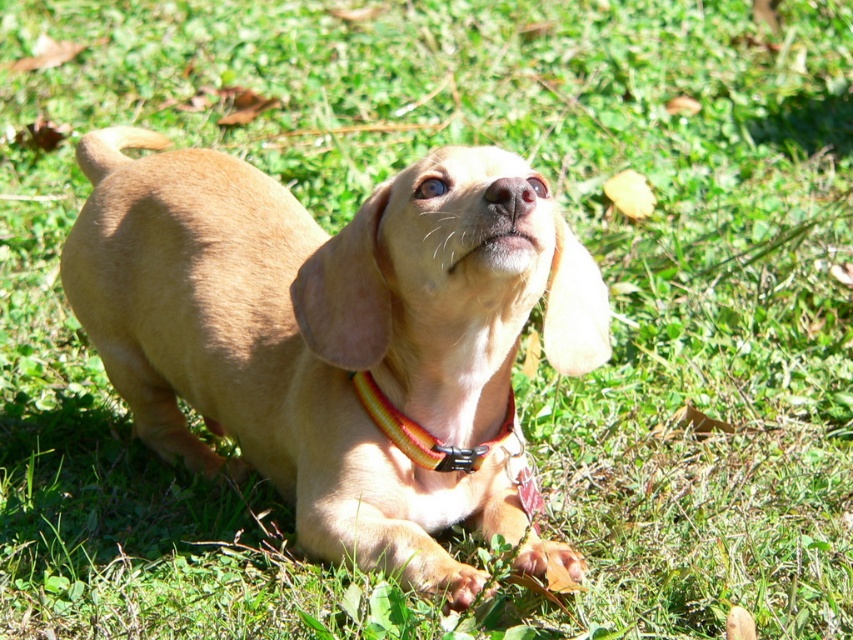
Question: Where is light brown fur at center located in relation to yellow/orange fabric collar at center in the image?

Choices:
 (A) left
 (B) right

Answer: (A)

Question: Observing the image, what is the correct spatial positioning of light brown fur at center in reference to yellow/orange fabric collar at center?

Choices:
 (A) left
 (B) right

Answer: (A)

Question: Which object is closer to the camera taking this photo?

Choices:
 (A) light brown fur at center
 (B) yellow/orange fabric collar at center

Answer: (A)

Question: Can you confirm if light brown fur at center is wider than yellow/orange fabric collar at center?

Choices:
 (A) no
 (B) yes

Answer: (B)

Question: Which object appears closest to the camera in this image?

Choices:
 (A) yellow/orange fabric collar at center
 (B) light brown fur at center

Answer: (B)